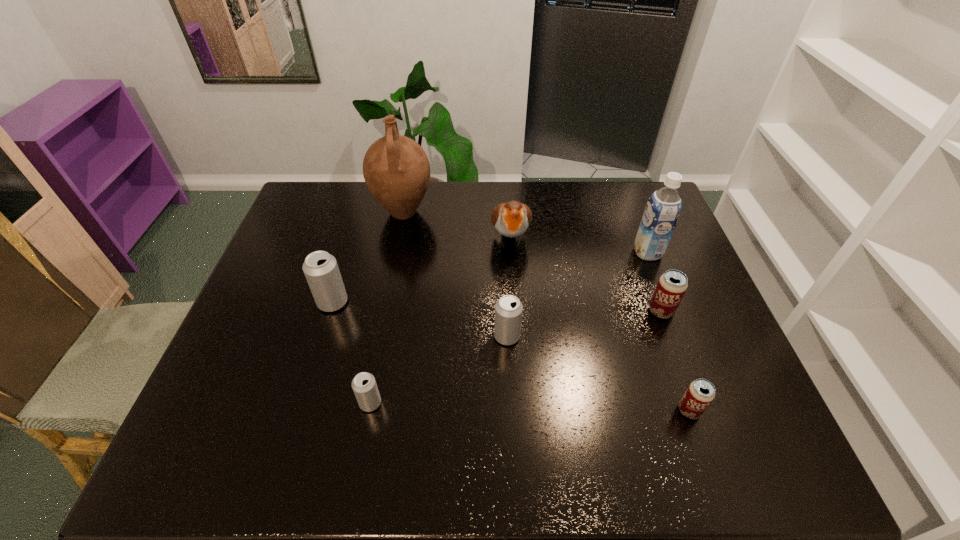
Locate an element on the screen. This screenshot has height=540, width=960. free space located 0.110m on the back of the second beer can from left to right is located at coordinates (380, 353).

Locate an element on the screen. The image size is (960, 540). vacant space located 0.070m on the back of the smaller red beer can is located at coordinates (676, 374).

Where is `pitcher that is positioned at the far edge`? Image resolution: width=960 pixels, height=540 pixels. pitcher that is positioned at the far edge is located at coordinates (396, 169).

Identify the location of bird that is positioned at the far edge. Image resolution: width=960 pixels, height=540 pixels. (512, 219).

Where is `soya milk situated at the right edge`? The width and height of the screenshot is (960, 540). soya milk situated at the right edge is located at coordinates (662, 211).

Image resolution: width=960 pixels, height=540 pixels. Identify the location of free space at the far edge of the desktop. (458, 220).

Where is `vacant space at the near edge of the desktop`? The height and width of the screenshot is (540, 960). vacant space at the near edge of the desktop is located at coordinates (610, 449).

The width and height of the screenshot is (960, 540). I want to click on free space at the left edge, so click(x=263, y=298).

Where is `vacant region at the right edge of the desktop`? The height and width of the screenshot is (540, 960). vacant region at the right edge of the desktop is located at coordinates (668, 264).

This screenshot has width=960, height=540. In the image, there is a desktop. In order to click on vacant space at the far left corner in this screenshot , I will do `click(342, 186)`.